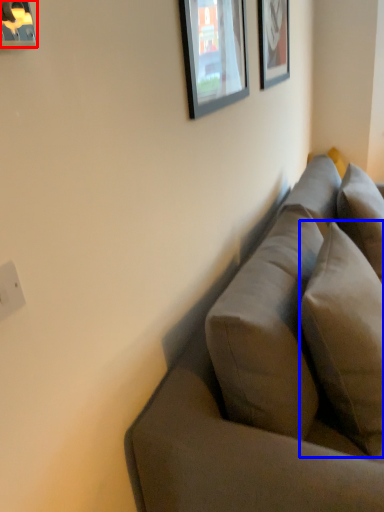
Question: Which object is further to the camera taking this photo, picture frame (highlighted by a red box) or pillow (highlighted by a blue box)?

Choices:
 (A) picture frame
 (B) pillow

Answer: (B)